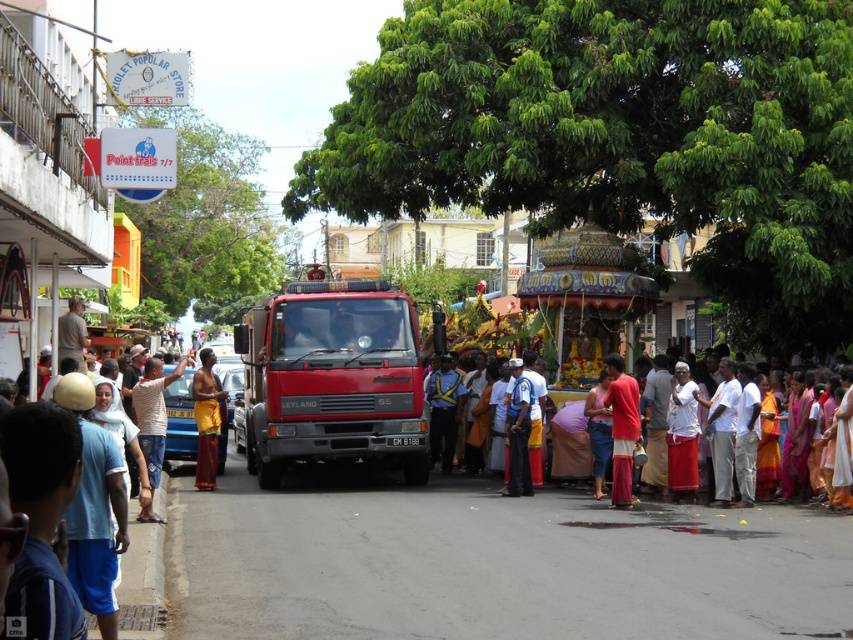
Question: Which is farther from the white cotton shirt at right?

Choices:
 (A) red matte truck at center
 (B) light blue uniform at center
 (C) red cotton dhoti at center

Answer: (A)

Question: In this image, where is red cotton dhoti at center located relative to light blue uniform at center?

Choices:
 (A) below
 (B) above

Answer: (B)

Question: Which object appears closest to the camera in this image?

Choices:
 (A) light brown shirt at center
 (B) yellow fabric cloth at center
 (C) white striped shirt at center

Answer: (C)

Question: Is yellow fabric cloth at center further to camera compared to light blue uniform at center?

Choices:
 (A) no
 (B) yes

Answer: (B)

Question: Which point appears farthest from the camera in this image?

Choices:
 (A) (672, 465)
 (B) (515, 362)
 (C) (630, 420)
 (D) (210, 458)

Answer: (D)

Question: Does white striped shirt at center have a larger size compared to red cotton dhoti at center?

Choices:
 (A) no
 (B) yes

Answer: (B)